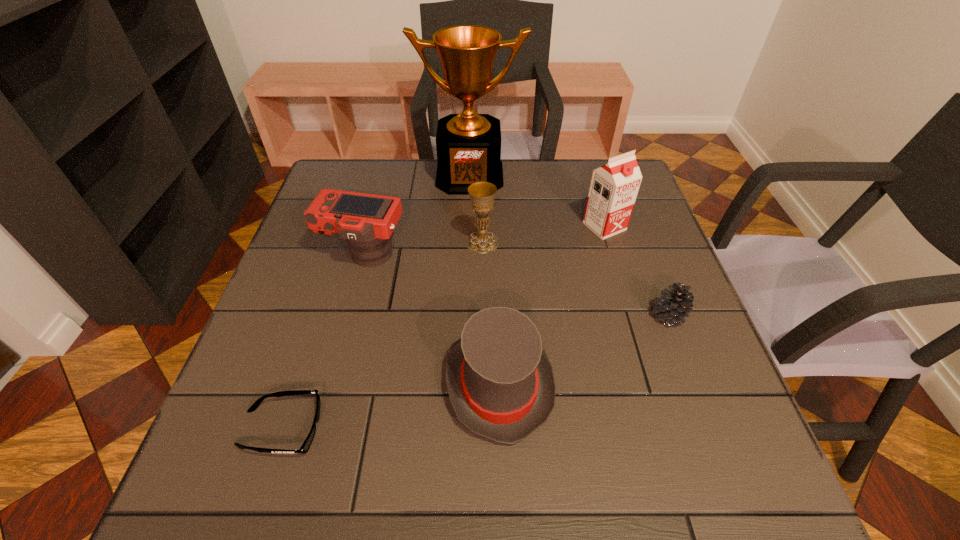
Identify the location of free location that satisfies the following two spatial constraints: 1. on the back side of the soya milk; 2. on the right side of the dress hat. (493, 226).

I want to click on vacant space that satisfies the following two spatial constraints: 1. on the front side of the dress hat; 2. on the front-facing side of the shortest object, so tap(500, 429).